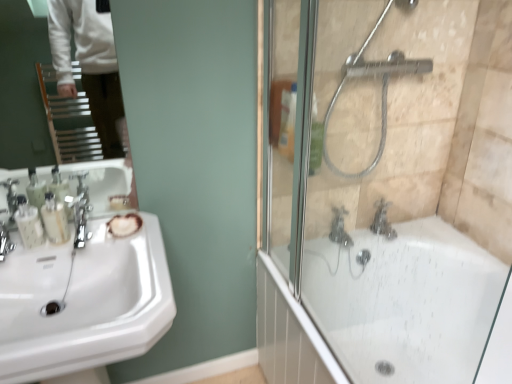
Question: In the image, is white glossy bathtub at right on the left side or the right side of satin nickel faucet at lower right, the 2th tap viewed from the left?

Choices:
 (A) right
 (B) left

Answer: (B)

Question: Considering the positions of white glossy bathtub at right and satin nickel faucet at lower right, arranged as the first tap when viewed from the right, in the image, is white glossy bathtub at right wider or thinner than satin nickel faucet at lower right, arranged as the first tap when viewed from the right,?

Choices:
 (A) thin
 (B) wide

Answer: (B)

Question: Estimate the real-world distances between objects in this image. Which object is closer to the satin nickel faucet at left, positioned as the 2th faucet in right-to-left order?

Choices:
 (A) polished chrome faucet at left, the 2th faucet viewed from the left
 (B) translucent glass shower door at right
 (C) translucent plastic soap dispenser at left, positioned as the first toiletry in right-to-left order
 (D) white glossy bathtub at right
 (E) satin nickel faucet at lower right, the 2th tap viewed from the left

Answer: (C)

Question: Estimate the real-world distances between objects in this image. Which object is closer to the silver metallic showerhead at upper right?

Choices:
 (A) matte white toothbrushes at left, which appears as the 1th toiletry when viewed from the left
 (B) silver metallic faucet at lower right, marked as the 1th tap in a left-to-right arrangement
 (C) translucent plastic soap dispenser at left, the second toiletry from the left
 (D) satin nickel faucet at lower right, arranged as the first tap when viewed from the right
 (E) white glossy bathtub at right

Answer: (D)